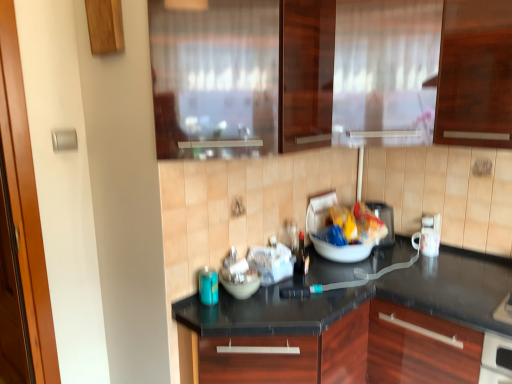
Question: Considering their positions, is frosted glass curtain at upper center located in front of or behind matte plastic toaster at center, the 3th appliance in the front-to-back sequence?

Choices:
 (A) behind
 (B) front

Answer: (B)

Question: Looking at their shapes, would you say frosted glass curtain at upper center is wider or thinner than matte plastic toaster at center, arranged as the second appliance when viewed from the right?

Choices:
 (A) thin
 (B) wide

Answer: (B)

Question: Considering the real-world distances, which object is farthest from the frosted glass curtain at upper center?

Choices:
 (A) black granite countertop at center
 (B) white glossy bowl at center
 (C) matte plastic toaster at center, which ranks as the 2th appliance in left-to-right order
 (D) matte plastic bag at center
 (E) white glossy mug at right, the first appliance when ordered from right to left

Answer: (B)

Question: Based on their relative distances, which object is farther from the matte plastic toaster at center, arranged as the 1th appliance when viewed from the back?

Choices:
 (A) white glossy bowl at center
 (B) black granite countertop at center
 (C) blue glass bottle at lower left, which is counted as the 3th appliance, starting from the right
 (D) white glossy mug at right, which is the 2th appliance in front-to-back order
 (E) matte plastic bag at center

Answer: (C)